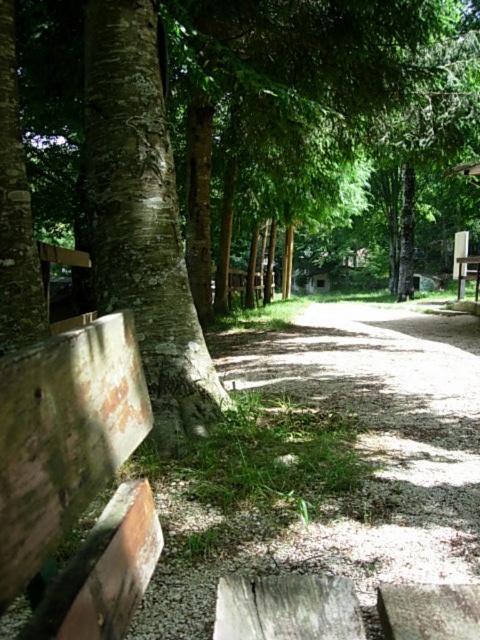
You are standing at the entrance of the park and want to sit on the rusty wood bench at lower left. According to the coordinates provided, is the bench closer to the entrance or further away?

The rusty wood bench at lower left is located at point [63,435], which indicates it is further away from the entrance since lower coordinates typically represent positions closer to the bottom of the image, suggesting the bench is positioned towards the lower part of the scene, likely further from the entrance.

Consider the image. You are planning to set up a small outdoor event and need to place a 10 meter long tent between the rusty wood bench at lower left and the wooden picnic table at center. Is there enough space to place the tent between them?

The distance between the rusty wood bench at lower left and the wooden picnic table at center is 11.86 meters, so yes, there is enough space to place a 10 meter long tent between them as the available space is longer than the tent.